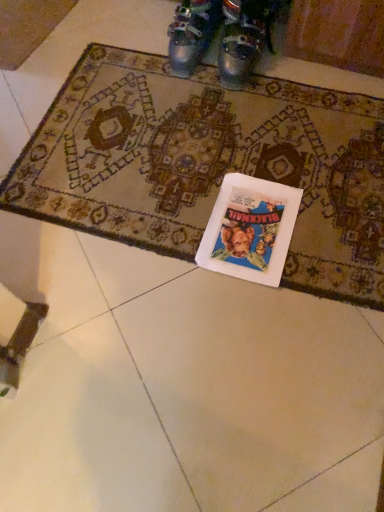
Where is `free point below carpeted mat at center (from a real-world perspective)`? The height and width of the screenshot is (512, 384). free point below carpeted mat at center (from a real-world perspective) is located at coordinates (211, 159).